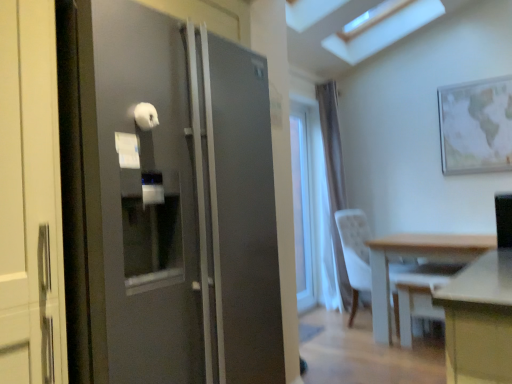
Question: From a real-world perspective, is light wood table at lower right on top of white sheer curtain at center?

Choices:
 (A) yes
 (B) no

Answer: (B)

Question: Can white sheer curtain at center be found inside light wood table at lower right?

Choices:
 (A) no
 (B) yes

Answer: (A)

Question: Considering the relative sizes of light wood table at lower right and white sheer curtain at center in the image provided, is light wood table at lower right taller than white sheer curtain at center?

Choices:
 (A) yes
 (B) no

Answer: (B)

Question: Is light wood table at lower right oriented away from white sheer curtain at center?

Choices:
 (A) yes
 (B) no

Answer: (B)

Question: Does light wood table at lower right come behind white sheer curtain at center?

Choices:
 (A) yes
 (B) no

Answer: (B)

Question: Considering the relative sizes of light wood table at lower right and white sheer curtain at center in the image provided, is light wood table at lower right smaller than white sheer curtain at center?

Choices:
 (A) yes
 (B) no

Answer: (B)

Question: Is white fabric chair at right with light wood table at lower right?

Choices:
 (A) yes
 (B) no

Answer: (B)

Question: Can you confirm if white fabric chair at right is positioned to the left of light wood table at lower right?

Choices:
 (A) yes
 (B) no

Answer: (A)

Question: From a real-world perspective, is white fabric chair at right beneath light wood table at lower right?

Choices:
 (A) no
 (B) yes

Answer: (A)

Question: Considering the relative sizes of white fabric chair at right and light wood table at lower right in the image provided, is white fabric chair at right taller than light wood table at lower right?

Choices:
 (A) yes
 (B) no

Answer: (A)

Question: Is light wood table at lower right inside white fabric chair at right?

Choices:
 (A) yes
 (B) no

Answer: (B)

Question: Is white fabric chair at right smaller than light wood table at lower right?

Choices:
 (A) yes
 (B) no

Answer: (A)

Question: Can you confirm if clear glass window at center is bigger than white plastic swivel chair at lower right?

Choices:
 (A) no
 (B) yes

Answer: (A)